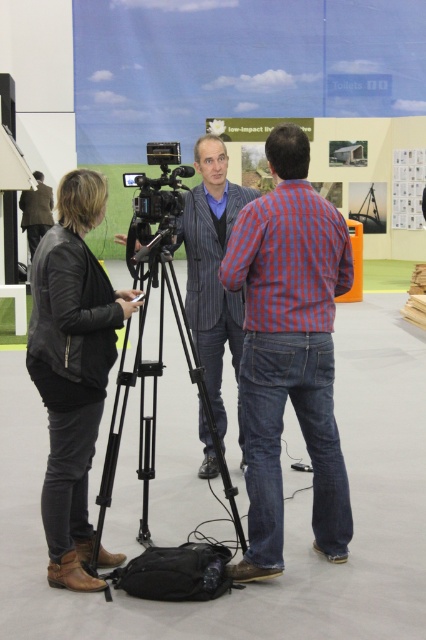
Question: Among these points, which one is farthest from the camera?

Choices:
 (A) (235, 310)
 (B) (63, 403)
 (C) (152, 396)

Answer: (C)

Question: Can you confirm if black metal tripod at center is thinner than black plastic video camera at center?

Choices:
 (A) yes
 (B) no

Answer: (B)

Question: Is matte blue projection screen at upper center to the right of red checkered shirt at center from the viewer's perspective?

Choices:
 (A) no
 (B) yes

Answer: (A)

Question: Which of the following is the closest to the observer?

Choices:
 (A) matte blue projection screen at upper center
 (B) brown leather jacket at center
 (C) red checkered shirt at center
 (D) black metal tripod at center

Answer: (C)

Question: Considering the real-world distances, which object is closest to the black plastic video camera at center?

Choices:
 (A) black metal tripod at center
 (B) striped fabric jacket at center

Answer: (B)

Question: Is the position of black leather jacket at left less distant than that of brown leather jacket at center?

Choices:
 (A) no
 (B) yes

Answer: (B)